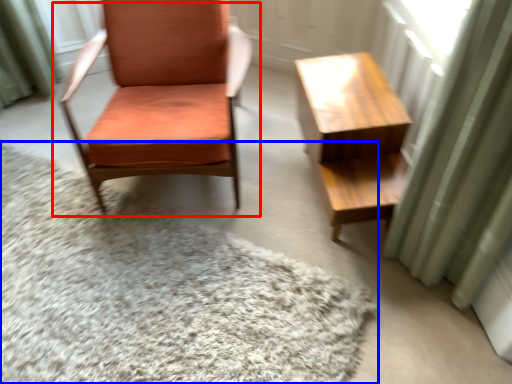
Question: Which of the following is the closest to the observer, chair (highlighted by a red box) or mat (highlighted by a blue box)?

Choices:
 (A) chair
 (B) mat

Answer: (B)